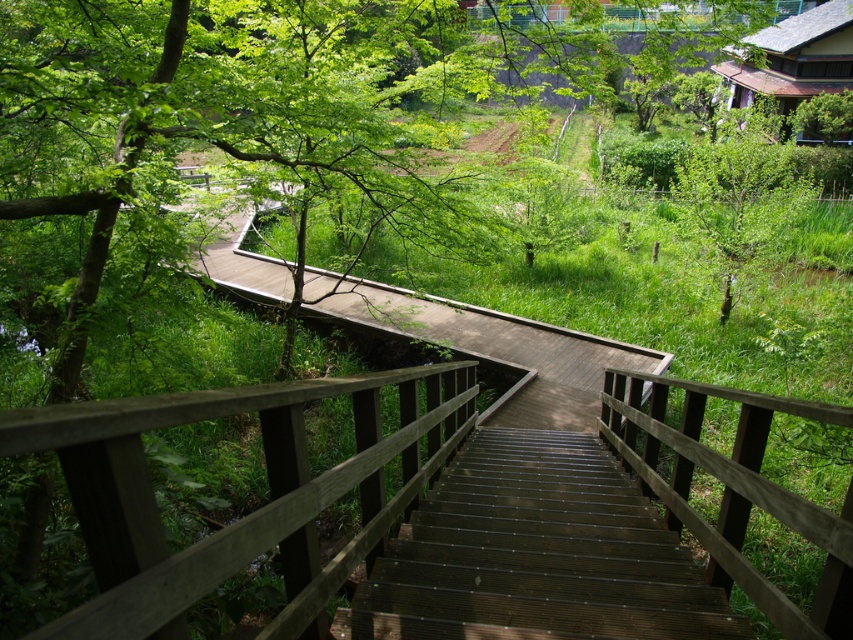
You are a painter carrying a 2.5 meter wide canvas. You need to walk down the dark brown wood stairs at center while avoiding the green leafy tree at upper right. Can you fit the canvas horizontally through the stairs?

The dark brown wood stairs at center has a width less than the green leafy tree at upper right. Since the canvas is 2.5 meters wide, and the stairs are narrower than the tree, but we don not know the exact width of the stairs, it is uncertain if the canvas will fit. Please check the actual width of the stairs before attempting.